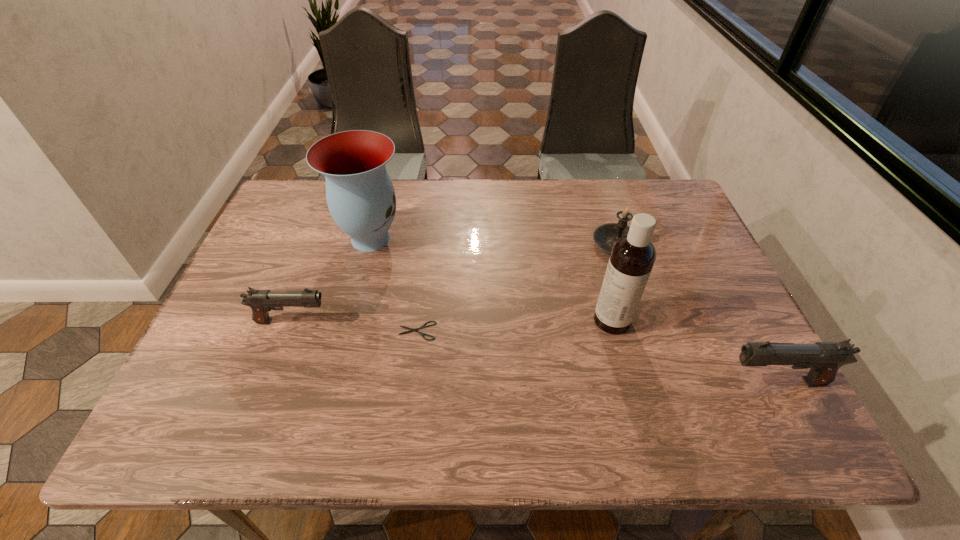
The image size is (960, 540). I want to click on blank area located 0.380m in the direction the rightmost object is aimed, so click(x=544, y=382).

I want to click on vacant position located 0.080m in the direction the rightmost object is aimed, so click(685, 382).

Find the location of a particular element. free spot located in the direction the rightmost object is aimed is located at coordinates (666, 382).

Identify the location of vacant area located 0.310m on the front of the vase. (339, 362).

Find the location of `vacant area located on the label side of the dishwasher detergent`. vacant area located on the label side of the dishwasher detergent is located at coordinates (455, 320).

Find the location of a particular element. This screenshot has height=540, width=960. blank space located 0.390m on the label side of the dishwasher detergent is located at coordinates (430, 320).

Find the location of a particular element. vacant space located 0.150m on the label side of the dishwasher detergent is located at coordinates (531, 320).

The image size is (960, 540). Identify the location of vacant area located 0.330m on the left of the shears. (257, 331).

Find the location of `vacant region located 0.240m on the left of the candle`. vacant region located 0.240m on the left of the candle is located at coordinates (507, 244).

The height and width of the screenshot is (540, 960). In order to click on object that is at the far edge in this screenshot , I will do `click(361, 199)`.